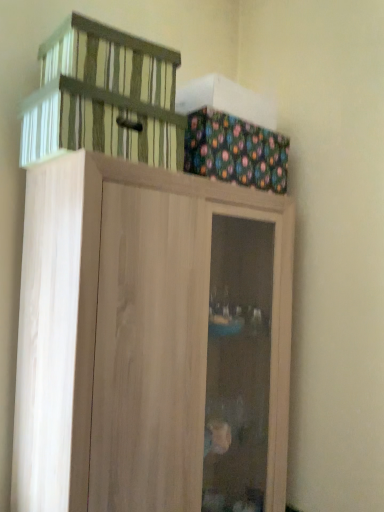
Question: In terms of size, does multicolored fabric box at upper right appear bigger or smaller than light wood cupboard at upper center?

Choices:
 (A) big
 (B) small

Answer: (B)

Question: From a real-world perspective, is multicolored fabric box at upper right above or below light wood cupboard at upper center?

Choices:
 (A) below
 (B) above

Answer: (B)

Question: Which of these objects is positioned closest to the multicolored fabric box at upper right?

Choices:
 (A) striped fabric basket at upper left
 (B) light wood cupboard at upper center

Answer: (A)

Question: Estimate the real-world distances between objects in this image. Which object is farther from the striped fabric basket at upper left?

Choices:
 (A) multicolored fabric box at upper right
 (B) light wood cupboard at upper center

Answer: (B)